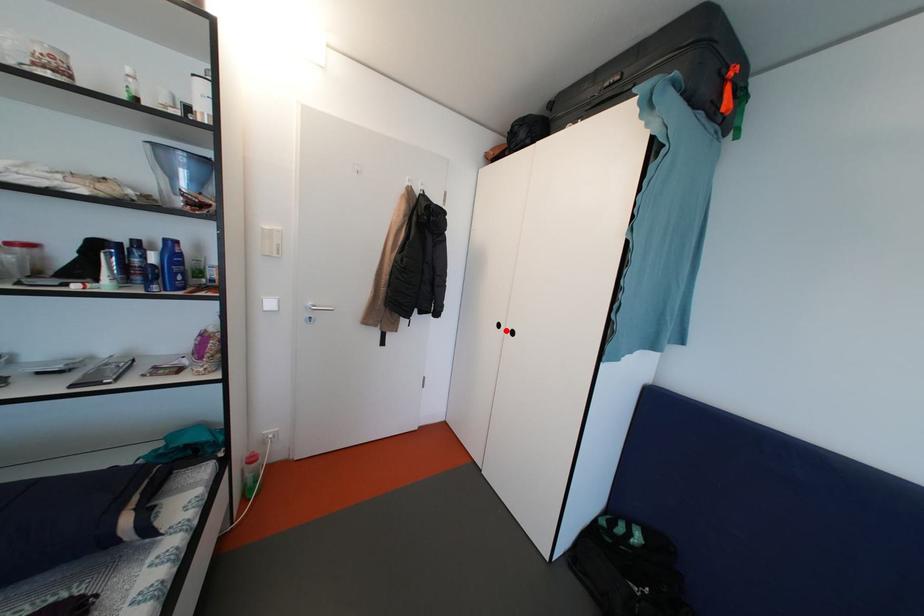
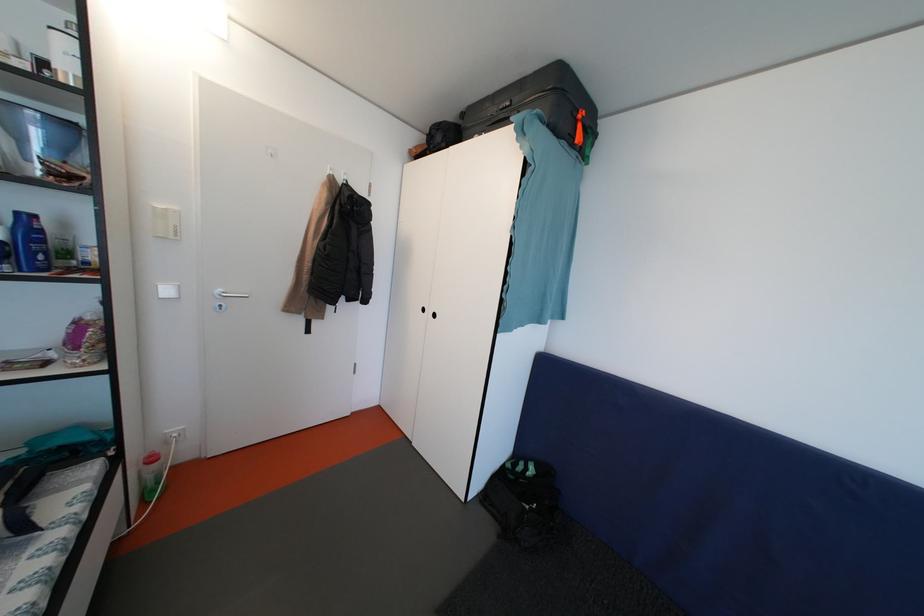
In the second image, find the point that corresponds to the highlighted location in the first image.

(431, 315)